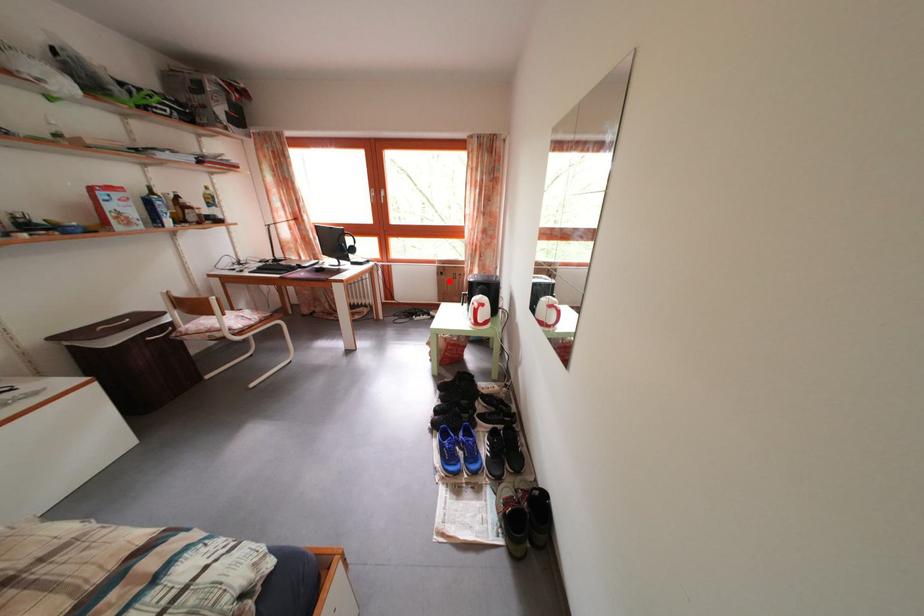
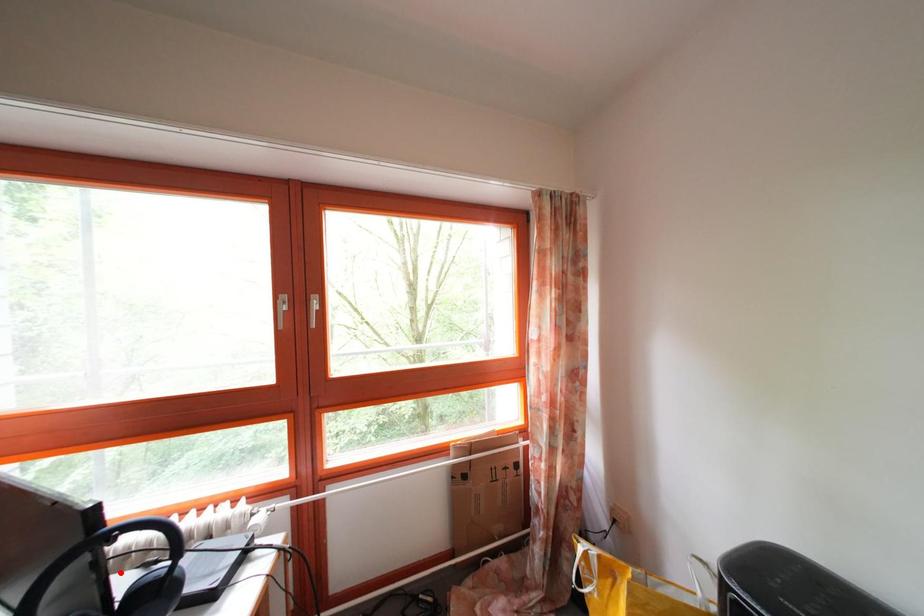
I am providing you with two images of the same scene from different viewpoints. A red point is marked on the first image and another point is marked on the second image. Is the marked point in image1 the same physical position as the marked point in image2?

No